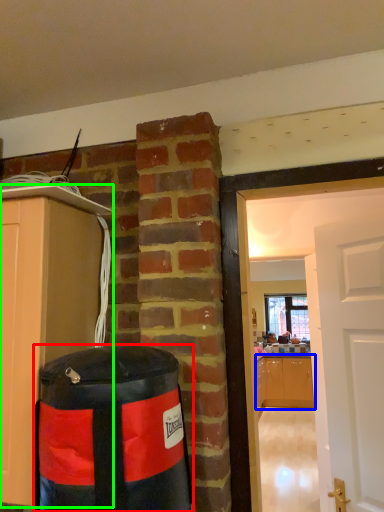
Question: Which is nearer to the punching bag (highlighted by a red box)? cabinetry (highlighted by a blue box) or cabinetry (highlighted by a green box).

Choices:
 (A) cabinetry
 (B) cabinetry

Answer: (B)